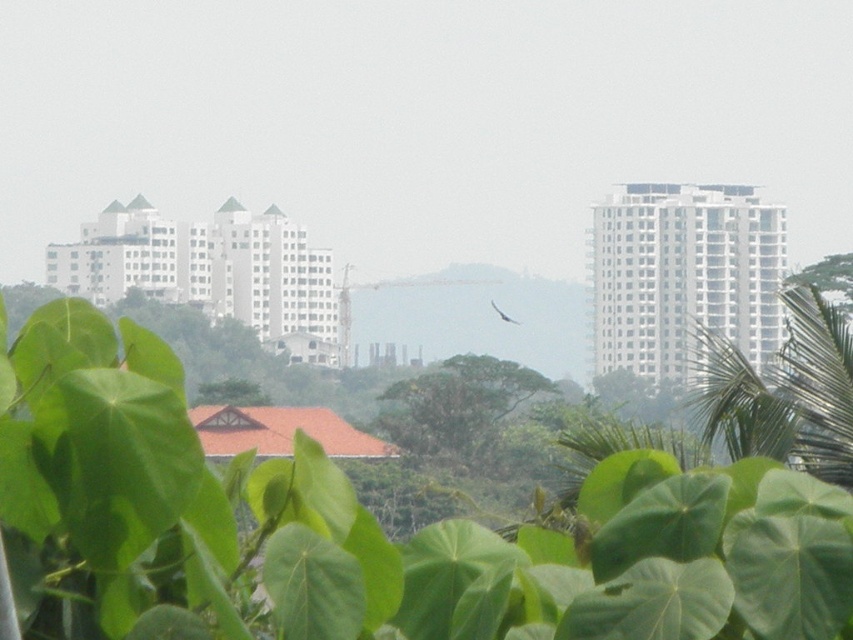
You are standing at the point marked by the coordinates point (456, 404) in the urban landscape. Which object are you currently standing on?

The point (456, 404) is on the green leafy tree at center, so you are standing on the green leafy tree at center.

You are a drone operator tasked with capturing aerial footage of the green leafy plant at center and the white glossy bird at center. The drone has a maximum range of 250 meters. Can the drone capture both subjects in a single flight without exceeding its range?

The green leafy plant at center and the white glossy bird at center are 248.14 meters apart. Since the drone has a maximum range of 250 meters, it can capture both subjects in a single flight as the distance between them is within the drone operator range limit.